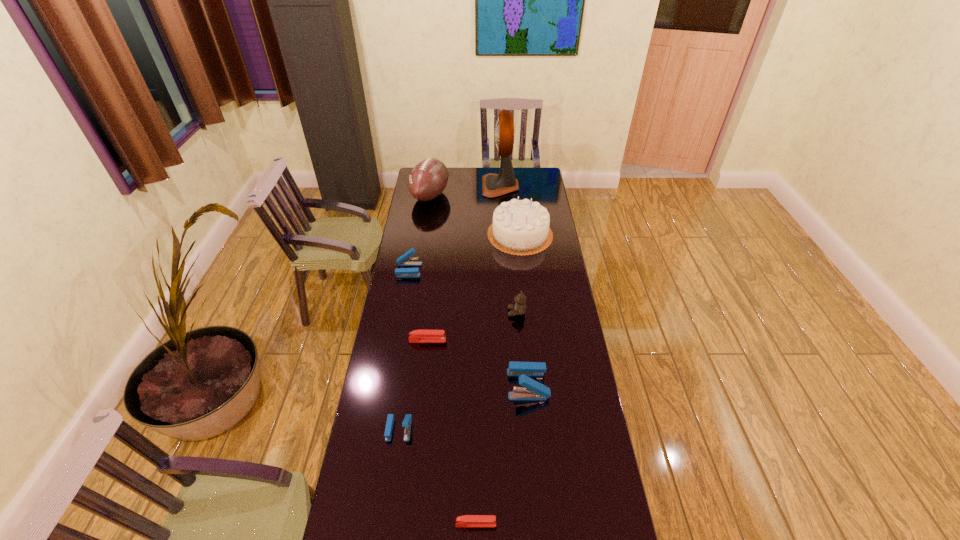
You are a GUI agent. You are given a task and a screenshot of the screen. Output one action in this format:
    pyautogui.click(x=<x>, y=<y>)
    Task: Click on the vacant point located between the football (American) and the seventh farthest object
    The image size is (960, 540).
    Given the screenshot: What is the action you would take?
    pyautogui.click(x=479, y=290)

Find the location of a particular element. The width and height of the screenshot is (960, 540). free space between the birthday cake and the farthest stapler is located at coordinates (465, 252).

You are a GUI agent. You are given a task and a screenshot of the screen. Output one action in this format:
    pyautogui.click(x=<x>, y=<y>)
    Task: Click on the vacant space in between the football (American) and the brown fan
    This screenshot has width=960, height=540.
    Given the screenshot: What is the action you would take?
    pyautogui.click(x=466, y=191)

You are a GUI agent. You are given a task and a screenshot of the screen. Output one action in this format:
    pyautogui.click(x=<x>, y=<y>)
    Task: Click on the free space between the football (American) and the sixth farthest object
    
    Given the screenshot: What is the action you would take?
    pyautogui.click(x=429, y=268)

Find the location of `free space between the third nearest object and the smaller red stapler`. free space between the third nearest object and the smaller red stapler is located at coordinates (502, 454).

At what (x,y) coordinates should I click in order to perform the action: click on the seventh closest object relative to the brown teddy bear. Please return your answer as a coordinate pair (x, y). This screenshot has height=540, width=960. Looking at the image, I should click on (465, 520).

This screenshot has height=540, width=960. I want to click on object that is the sixth closest one to the fourth stapler from left to right, so click(520, 227).

Locate an element on the screen. The height and width of the screenshot is (540, 960). stapler that is the nearest to the second farthest stapler is located at coordinates (534, 391).

Select which stapler is the third closest to the second tallest stapler. Please provide its 2D coordinates. Your answer should be formatted as a tuple, i.e. [(x, y)], where the tuple contains the x and y coordinates of a point satisfying the conditions above.

[(407, 421)]

Locate which blue stapler is the closest to the third nearest stapler. Please provide its 2D coordinates. Your answer should be formatted as a tuple, i.e. [(x, y)], where the tuple contains the x and y coordinates of a point satisfying the conditions above.

[(407, 421)]